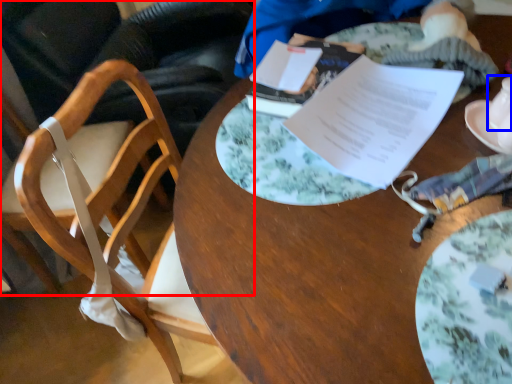
Question: Which object appears farthest to the camera in this image, chair (highlighted by a red box) or tableware (highlighted by a blue box)?

Choices:
 (A) chair
 (B) tableware

Answer: (A)